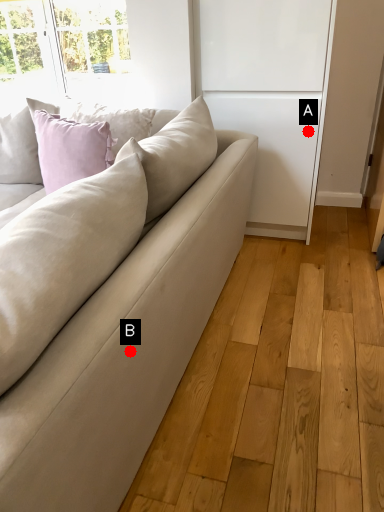
Question: Two points are circled on the image, labeled by A and B beside each circle. Which point is farther from the camera taking this photo?

Choices:
 (A) A is further
 (B) B is further

Answer: (A)